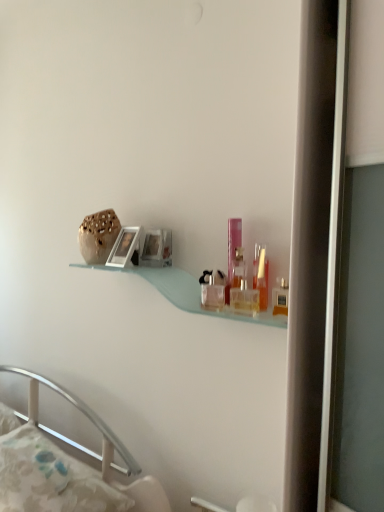
Question: Considering the relative sizes of pink plastic perfume at center, the third toiletry positioned from the right, and white fabric pillow at lower left in the image provided, is pink plastic perfume at center, the third toiletry positioned from the right, smaller than white fabric pillow at lower left?

Choices:
 (A) yes
 (B) no

Answer: (A)

Question: Does pink plastic perfume at center, the third toiletry positioned from the right, have a lesser height compared to white fabric pillow at lower left?

Choices:
 (A) no
 (B) yes

Answer: (A)

Question: Could you tell me if pink plastic perfume at center, which is counted as the second toiletry, starting from the left, is facing white fabric pillow at lower left?

Choices:
 (A) yes
 (B) no

Answer: (B)

Question: From a real-world perspective, is pink plastic perfume at center, which is counted as the second toiletry, starting from the left, on white fabric pillow at lower left?

Choices:
 (A) yes
 (B) no

Answer: (A)

Question: Is pink plastic perfume at center, the 1th toiletry when ordered from back to front, looking in the opposite direction of white fabric pillow at lower left?

Choices:
 (A) yes
 (B) no

Answer: (B)

Question: Can you confirm if pink plastic perfume at center, which is counted as the second toiletry, starting from the left, is bigger than white fabric pillow at lower left?

Choices:
 (A) yes
 (B) no

Answer: (B)

Question: Is matte plastic toiletry at right, placed as the 4th toiletry when sorted from left to right, inside clear glass perfume bottles at center, arranged as the third toiletry when viewed from the front?

Choices:
 (A) yes
 (B) no

Answer: (B)

Question: Is there a large distance between clear glass perfume bottles at center, which appears as the second toiletry when viewed from the back, and matte plastic toiletry at right, the 1th toiletry when ordered from front to back?

Choices:
 (A) no
 (B) yes

Answer: (A)

Question: Is clear glass perfume bottles at center, which is the first toiletry in left-to-right order, at the right side of matte plastic toiletry at right, placed as the 4th toiletry when sorted from left to right?

Choices:
 (A) no
 (B) yes

Answer: (A)

Question: Is clear glass perfume bottles at center, arranged as the third toiletry when viewed from the front, placed right next to matte plastic toiletry at right, the 1th toiletry when ordered from front to back?

Choices:
 (A) yes
 (B) no

Answer: (B)

Question: Does clear glass perfume bottles at center, marked as the fourth toiletry in a right-to-left arrangement, appear on the left side of matte plastic toiletry at right, placed as the 4th toiletry when sorted from left to right?

Choices:
 (A) no
 (B) yes

Answer: (B)

Question: From a real-world perspective, is clear glass perfume bottles at center, which is the first toiletry in left-to-right order, positioned over matte plastic toiletry at right, which is counted as the 1th toiletry, starting from the right, based on gravity?

Choices:
 (A) no
 (B) yes

Answer: (A)

Question: Is white glossy picture frame at upper center outside white fabric pillow at lower left?

Choices:
 (A) yes
 (B) no

Answer: (A)